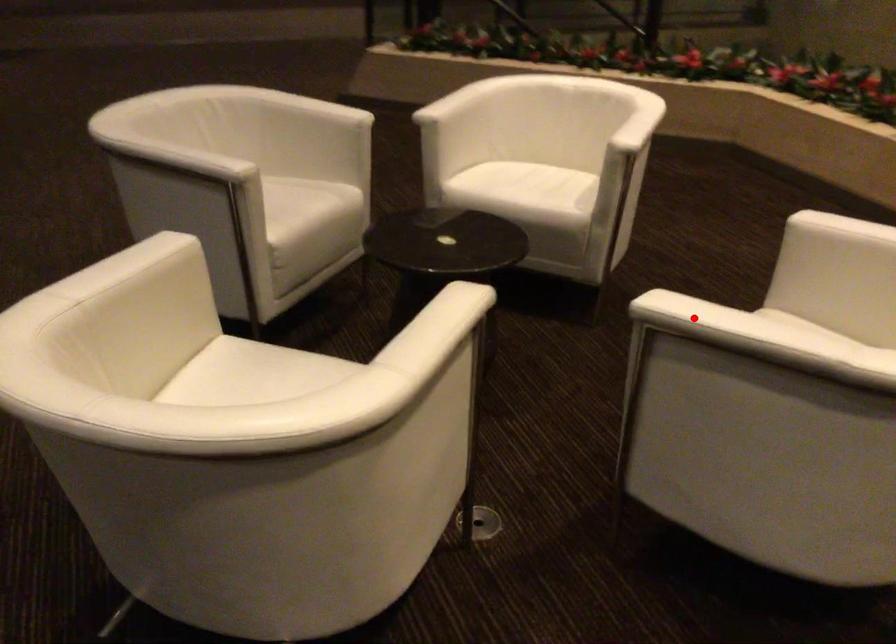
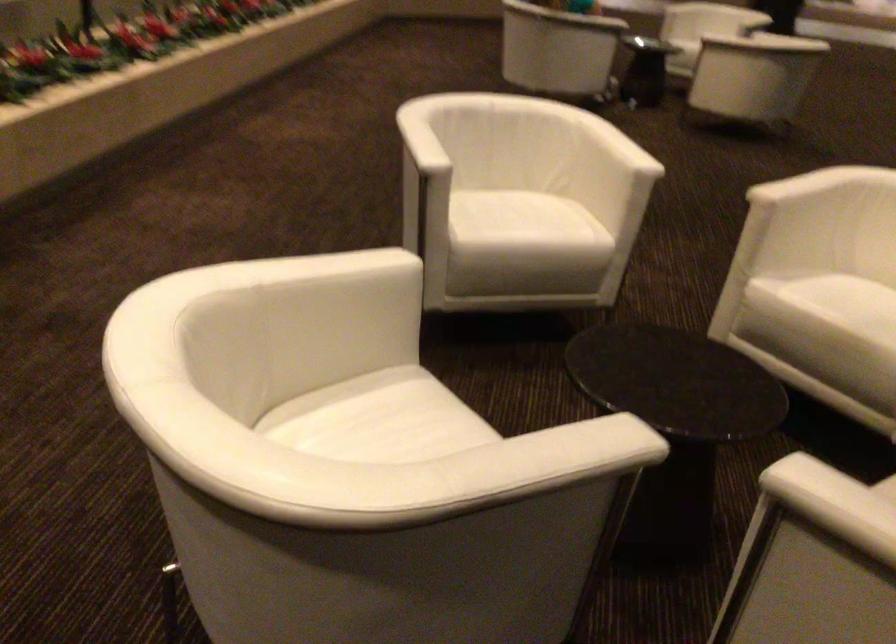
Question: I am providing you with two images of the same scene from different viewpoints. A red point is marked on the first image. At the location where the point appears in image 1, is it still visible in image 2?

Choices:
 (A) Yes
 (B) No

Answer: (B)